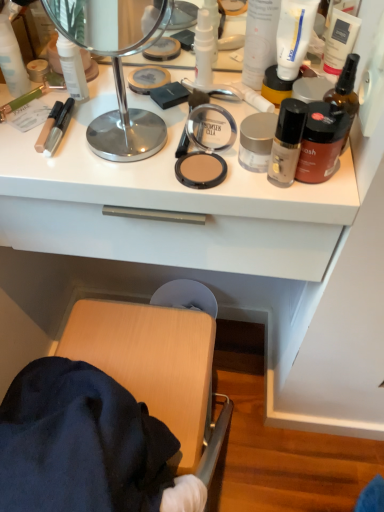
Question: Does white matte lotion at upper right, positioned as the 6th toiletry in right-to-left order, appear on the right side of white matte countertop at upper center?

Choices:
 (A) yes
 (B) no

Answer: (A)

Question: From the image's perspective, is white matte lotion at upper right, the fifth toiletry positioned from the left, beneath white matte countertop at upper center?

Choices:
 (A) yes
 (B) no

Answer: (B)

Question: Does white matte lotion at upper right, positioned as the 6th toiletry in right-to-left order, have a lesser height compared to white matte countertop at upper center?

Choices:
 (A) yes
 (B) no

Answer: (B)

Question: Is white matte lotion at upper right, the fifth toiletry positioned from the left, smaller than white matte countertop at upper center?

Choices:
 (A) yes
 (B) no

Answer: (A)

Question: Is white matte lotion at upper right, the fifth toiletry positioned from the left, to the left or to the right of matte brown compact at center in the image?

Choices:
 (A) left
 (B) right

Answer: (B)

Question: Looking at their shapes, would you say white matte lotion at upper right, the fifth toiletry positioned from the left, is wider or thinner than matte brown compact at center?

Choices:
 (A) wide
 (B) thin

Answer: (B)

Question: From the image's perspective, is white matte lotion at upper right, the fifth toiletry positioned from the left, located above or below matte brown compact at center?

Choices:
 (A) below
 (B) above

Answer: (B)

Question: Considering the positions of white matte lotion at upper right, positioned as the 6th toiletry in right-to-left order, and matte brown compact at center in the image, is white matte lotion at upper right, positioned as the 6th toiletry in right-to-left order, taller or shorter than matte brown compact at center?

Choices:
 (A) short
 (B) tall

Answer: (B)

Question: Considering the positions of yellow matte jar at upper right, which ranks as the seventh toiletry in left-to-right order, and white matte lotion at upper right, positioned as the 6th toiletry in right-to-left order, in the image, is yellow matte jar at upper right, which ranks as the seventh toiletry in left-to-right order, taller or shorter than white matte lotion at upper right, positioned as the 6th toiletry in right-to-left order,?

Choices:
 (A) short
 (B) tall

Answer: (A)

Question: Considering the positions of yellow matte jar at upper right, the 4th toiletry from the right, and white matte lotion at upper right, the fifth toiletry positioned from the left, in the image, is yellow matte jar at upper right, the 4th toiletry from the right, bigger or smaller than white matte lotion at upper right, the fifth toiletry positioned from the left,?

Choices:
 (A) small
 (B) big

Answer: (A)

Question: Is yellow matte jar at upper right, which ranks as the seventh toiletry in left-to-right order, to the left or to the right of white matte lotion at upper right, positioned as the 6th toiletry in right-to-left order, in the image?

Choices:
 (A) right
 (B) left

Answer: (A)

Question: Does point (291, 81) appear closer or farther from the camera than point (261, 37)?

Choices:
 (A) closer
 (B) farther

Answer: (A)

Question: Considering the positions of white matte lotion at upper right, positioned as the 6th toiletry in right-to-left order, and polished silver mirror at upper center in the image, is white matte lotion at upper right, positioned as the 6th toiletry in right-to-left order, taller or shorter than polished silver mirror at upper center?

Choices:
 (A) short
 (B) tall

Answer: (A)

Question: From the image's perspective, is white matte lotion at upper right, the fifth toiletry positioned from the left, located above or below polished silver mirror at upper center?

Choices:
 (A) below
 (B) above

Answer: (B)